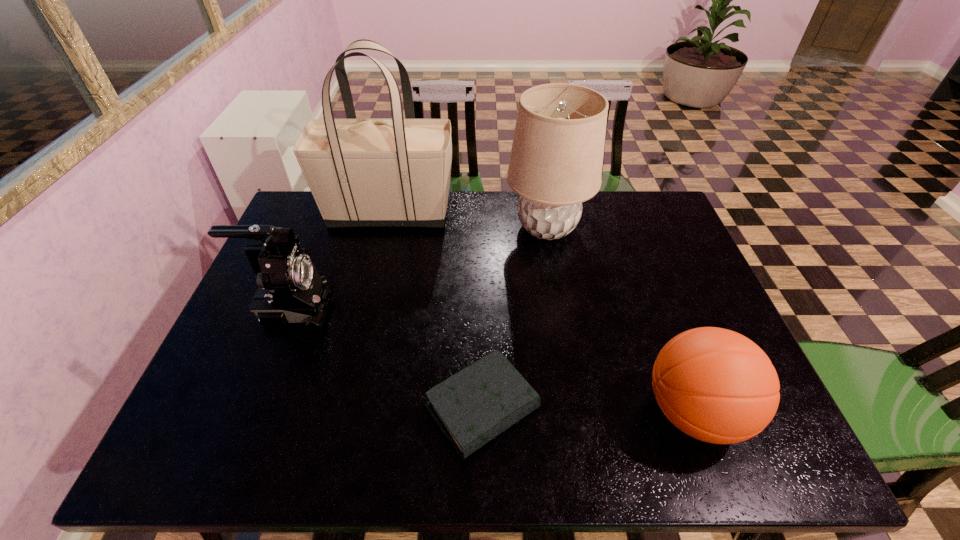
This screenshot has width=960, height=540. Identify the location of vacant space that satisfies the following two spatial constraints: 1. on the lens mount of the camcorder; 2. on the back side of the basketball. click(x=250, y=412).

You are a GUI agent. You are given a task and a screenshot of the screen. Output one action in this format:
    pyautogui.click(x=<x>, y=<y>)
    Task: Click on the blank space that satisfies the following two spatial constraints: 1. on the lens mount of the third nearest object; 2. on the right side of the Bible
    Image resolution: width=960 pixels, height=540 pixels.
    Given the screenshot: What is the action you would take?
    pyautogui.click(x=252, y=408)

Where is `vacant point that satisfies the following two spatial constraints: 1. with handles facing forward on the Bible; 2. on the left side of the shopping bag`? The height and width of the screenshot is (540, 960). vacant point that satisfies the following two spatial constraints: 1. with handles facing forward on the Bible; 2. on the left side of the shopping bag is located at coordinates (342, 408).

You are a GUI agent. You are given a task and a screenshot of the screen. Output one action in this format:
    pyautogui.click(x=<x>, y=<y>)
    Task: Click on the free spot that satisfies the following two spatial constraints: 1. on the front side of the basketball; 2. on the right side of the shortest object
    
    Given the screenshot: What is the action you would take?
    pyautogui.click(x=482, y=412)

Locate an element on the screen. vacant space that satisfies the following two spatial constraints: 1. on the lens mount of the camcorder; 2. on the back side of the fourth tallest object is located at coordinates (250, 412).